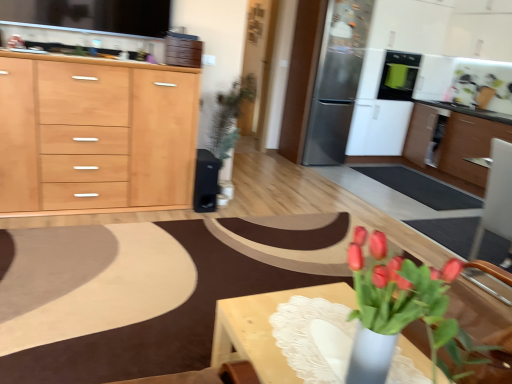
The image size is (512, 384). What are the coordinates of `vacant space to the right of black matte speaker at center, which ranks as the 3th appliance in back-to-front order` in the screenshot? It's located at (236, 205).